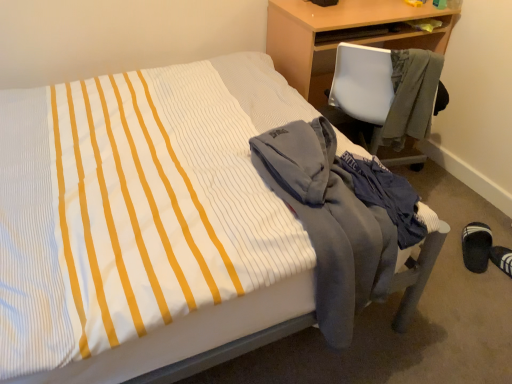
Question: Is gray fleece jacket at right, which is the second jacket from left to right, facing towards wooden desk at upper right?

Choices:
 (A) no
 (B) yes

Answer: (B)

Question: From a real-world perspective, is gray fleece jacket at right, which is the second jacket from left to right, beneath wooden desk at upper right?

Choices:
 (A) yes
 (B) no

Answer: (B)

Question: Does gray fleece jacket at right, the second jacket when ordered from bottom to top, have a smaller size compared to wooden desk at upper right?

Choices:
 (A) no
 (B) yes

Answer: (B)

Question: From the image's perspective, is gray fleece jacket at right, the second jacket when ordered from bottom to top, located beneath wooden desk at upper right?

Choices:
 (A) yes
 (B) no

Answer: (A)

Question: Can you see gray fleece jacket at right, the second jacket when ordered from bottom to top, touching wooden desk at upper right?

Choices:
 (A) yes
 (B) no

Answer: (B)

Question: Is gray fleece jacket at right, the 1th jacket viewed from the right, shorter than wooden desk at upper right?

Choices:
 (A) yes
 (B) no

Answer: (A)

Question: Considering the relative sizes of gray fleece jacket at right, which is the second jacket from left to right, and gray fleece jacket at lower right, the 1th jacket when ordered from bottom to top, in the image provided, is gray fleece jacket at right, which is the second jacket from left to right, smaller than gray fleece jacket at lower right, the 1th jacket when ordered from bottom to top,?

Choices:
 (A) no
 (B) yes

Answer: (B)

Question: Is gray fleece jacket at lower right, which appears as the 2th jacket when viewed from the right, located within gray fleece jacket at right, the 1th jacket viewed from the right?

Choices:
 (A) yes
 (B) no

Answer: (B)

Question: Does gray fleece jacket at right, the second jacket when ordered from bottom to top, have a lesser width compared to gray fleece jacket at lower right, the second jacket from the top?

Choices:
 (A) no
 (B) yes

Answer: (B)

Question: Is the depth of gray fleece jacket at right, the 1th jacket viewed from the right, greater than that of gray fleece jacket at lower right, which appears as the 2th jacket when viewed from the right?

Choices:
 (A) no
 (B) yes

Answer: (B)

Question: Is gray fleece jacket at lower right, which appears as the 2th jacket when viewed from the right, at the back of gray fleece jacket at right, placed as the 1th jacket when sorted from top to bottom?

Choices:
 (A) yes
 (B) no

Answer: (A)

Question: Considering the relative sizes of gray fleece jacket at right, placed as the 1th jacket when sorted from top to bottom, and gray fleece jacket at lower right, the 1th jacket when ordered from bottom to top, in the image provided, is gray fleece jacket at right, placed as the 1th jacket when sorted from top to bottom, taller than gray fleece jacket at lower right, the 1th jacket when ordered from bottom to top,?

Choices:
 (A) yes
 (B) no

Answer: (B)

Question: Is gray fleece jacket at lower right, which ranks as the first jacket in left-to-right order, far from black fabric slipper at lower right?

Choices:
 (A) no
 (B) yes

Answer: (A)